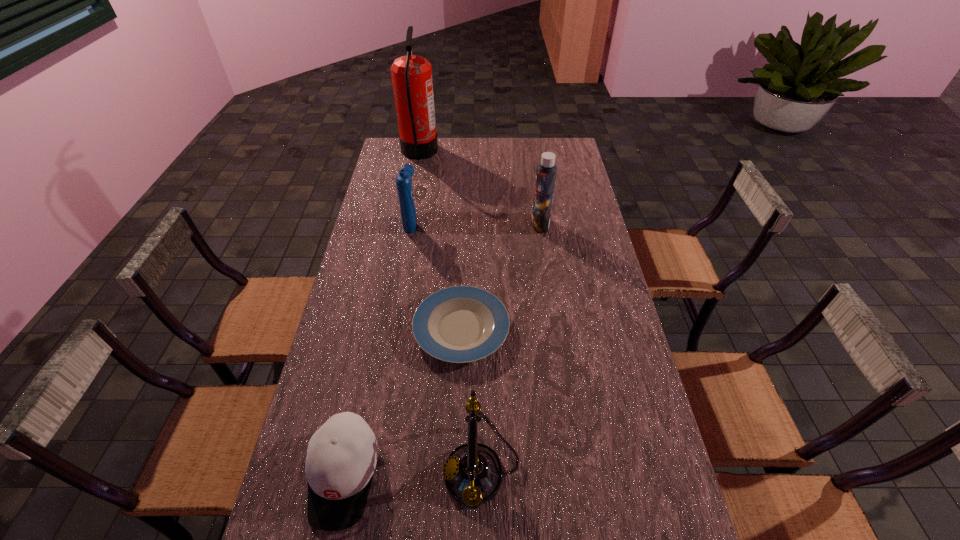
Image resolution: width=960 pixels, height=540 pixels. I want to click on vacant space located on the front side of the fire extinguisher, so click(x=501, y=152).

The height and width of the screenshot is (540, 960). Identify the location of free spot located 0.350m on the front label of the fifth shortest object. (441, 224).

The width and height of the screenshot is (960, 540). What are the coordinates of `vacant space located on the front label of the fifth shortest object` in the screenshot? It's located at (494, 224).

Locate an element on the screen. Image resolution: width=960 pixels, height=540 pixels. free space located 0.310m on the front label of the fifth shortest object is located at coordinates (451, 224).

Find the location of a particular element. vacant region located 0.120m on the front of the third tallest object is located at coordinates (406, 255).

Where is `free region located 0.290m on the dial of the telephone`? free region located 0.290m on the dial of the telephone is located at coordinates click(x=324, y=470).

You are a GUI agent. You are given a task and a screenshot of the screen. Output one action in this format:
    pyautogui.click(x=<x>, y=<y>)
    Task: Click on the free space located 0.080m on the dial of the telephone
    
    Given the screenshot: What is the action you would take?
    pyautogui.click(x=411, y=470)

In order to click on vacant area situated on the dial of the telephone in this screenshot , I will do `click(423, 470)`.

The width and height of the screenshot is (960, 540). I want to click on blank area located on the right of the fourth farthest object, so click(600, 329).

Where is `object at the far edge`? Image resolution: width=960 pixels, height=540 pixels. object at the far edge is located at coordinates click(x=411, y=75).